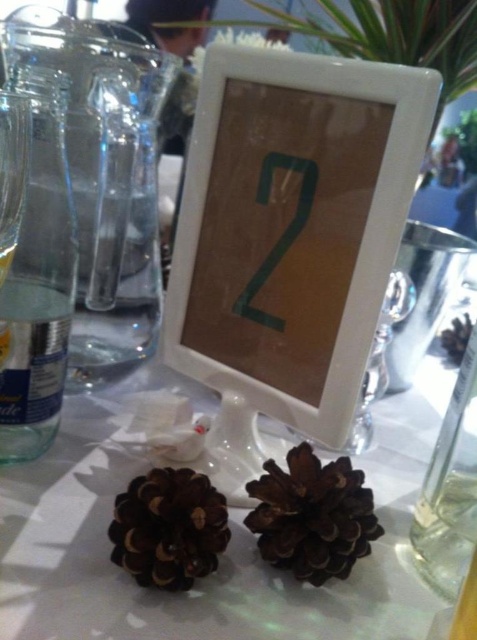
You are a guest at a formal dinner and you see the clear glass bottle at left and the green cardboard number at center on the table. Which object is taller?

The clear glass bottle at left is much taller than the green cardboard number at center.

Based on the photo, you are arranging flowers for a centerpiece and need to place a bouquet between the brown matte pine cone at lower left and the clear glass bottle at right. Which object should you move to make space?

The brown matte pine cone at lower left occupies less space than the clear glass bottle at right, so you should move the clear glass bottle at right to make more space for the bouquet.